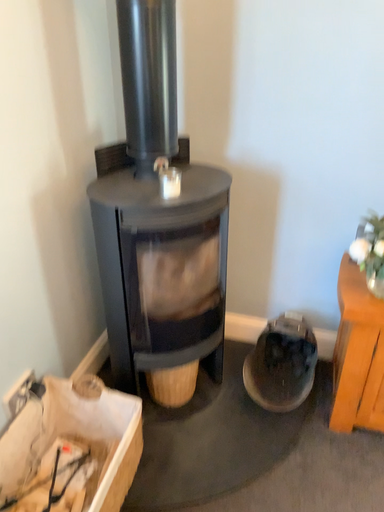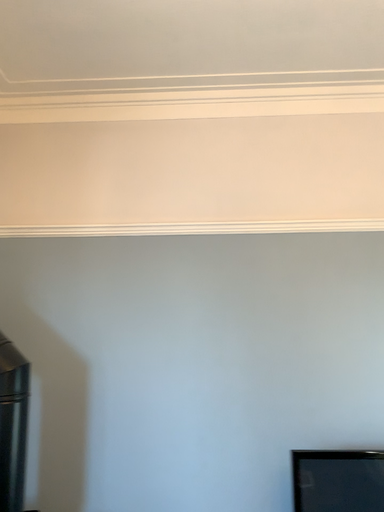
Question: Which way did the camera rotate in the video?

Choices:
 (A) rotated left
 (B) rotated right

Answer: (B)